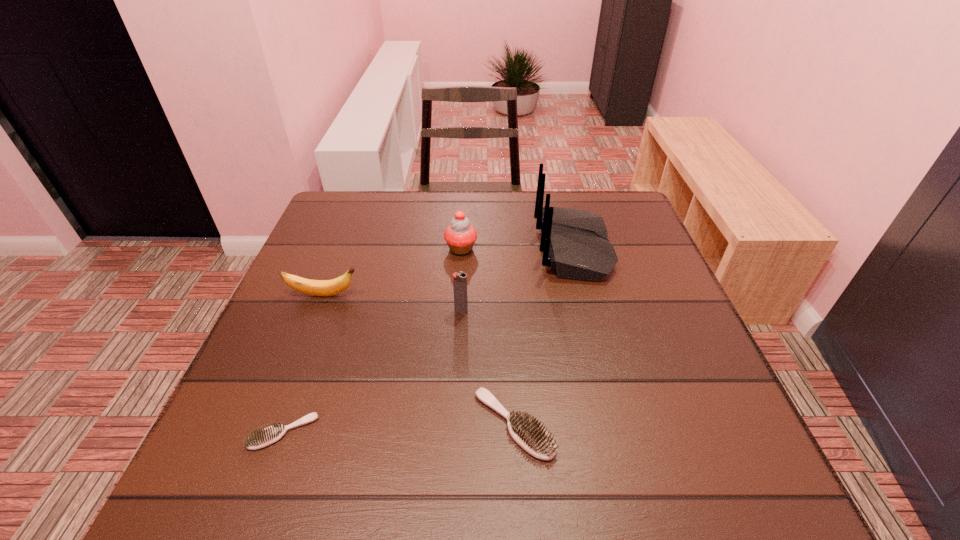
The height and width of the screenshot is (540, 960). Find the location of `vacant space located on the right of the shorter scrubbing brush`. vacant space located on the right of the shorter scrubbing brush is located at coordinates (540, 432).

Find the location of a particular element. The height and width of the screenshot is (540, 960). blank space located 0.080m on the left of the taller scrubbing brush is located at coordinates (429, 424).

This screenshot has height=540, width=960. In order to click on vacant region located on the back of the cupcake in this screenshot , I will do `click(464, 202)`.

This screenshot has width=960, height=540. In order to click on vacant space positioned on the back of the router in this screenshot , I will do `click(480, 248)`.

Locate an element on the screen. Image resolution: width=960 pixels, height=540 pixels. vacant region located on the back of the router is located at coordinates (434, 248).

What are the coordinates of `free spot located 0.070m on the back of the router` in the screenshot? It's located at (510, 248).

This screenshot has height=540, width=960. Identify the location of blank space located at the stem of the third shortest object. (468, 295).

Find the location of a particular element. This screenshot has width=960, height=540. vacant region located on the back of the igniter is located at coordinates (462, 287).

Find the location of a particular element. The image size is (960, 540). object at the far edge is located at coordinates (574, 242).

What are the coordinates of `scrubbing brush at the left edge` in the screenshot? It's located at (260, 438).